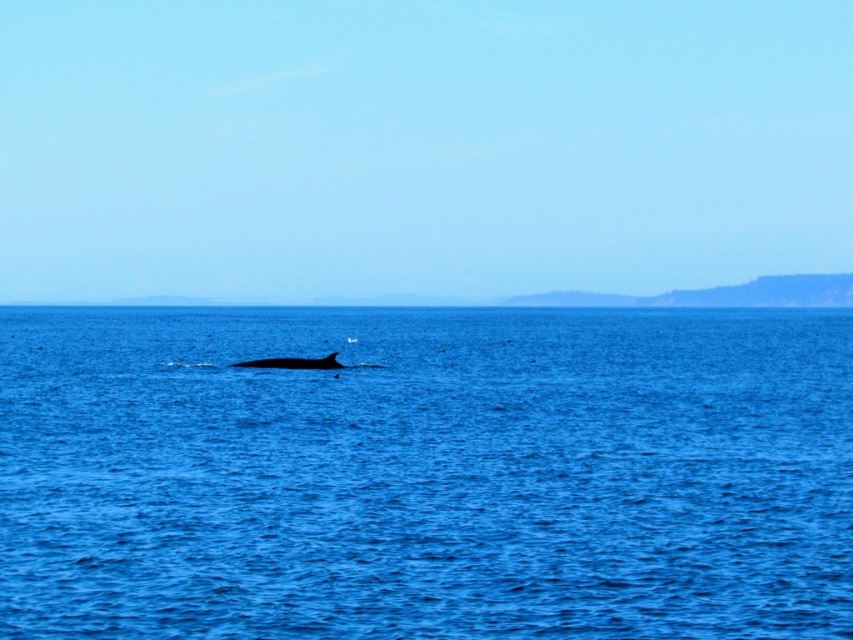
Question: Is the position of blue water at center less distant than that of gray matte whale at center?

Choices:
 (A) no
 (B) yes

Answer: (B)

Question: Observing the image, what is the correct spatial positioning of blue water at center in reference to gray matte whale at center?

Choices:
 (A) left
 (B) right

Answer: (A)

Question: Is blue water at center below gray matte whale at center?

Choices:
 (A) yes
 (B) no

Answer: (B)

Question: Which of the following is the closest to the observer?

Choices:
 (A) gray matte whale at center
 (B) blue water at center

Answer: (B)

Question: Which point is closer to the camera?

Choices:
 (A) gray matte whale at center
 (B) blue water at center

Answer: (B)